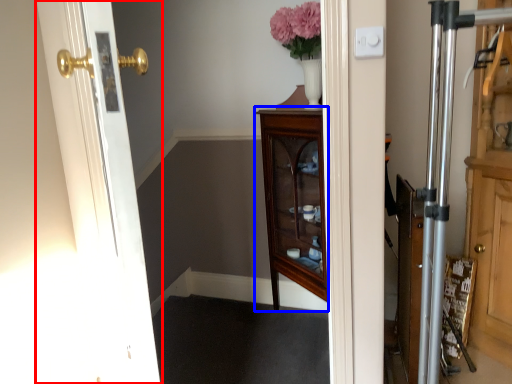
Question: Which point is further to the camera, door (highlighted by a red box) or furniture (highlighted by a blue box)?

Choices:
 (A) door
 (B) furniture

Answer: (B)